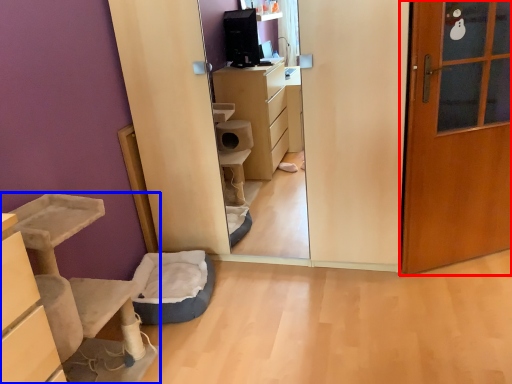
Question: Which object appears closest to the camera in this image, door (highlighted by a red box) or furniture (highlighted by a blue box)?

Choices:
 (A) door
 (B) furniture

Answer: (B)